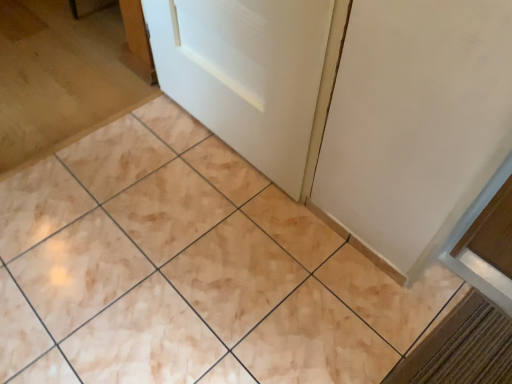
Find the location of a particular element. free space above beige marble tile at center (from a real-world perspective) is located at coordinates (195, 261).